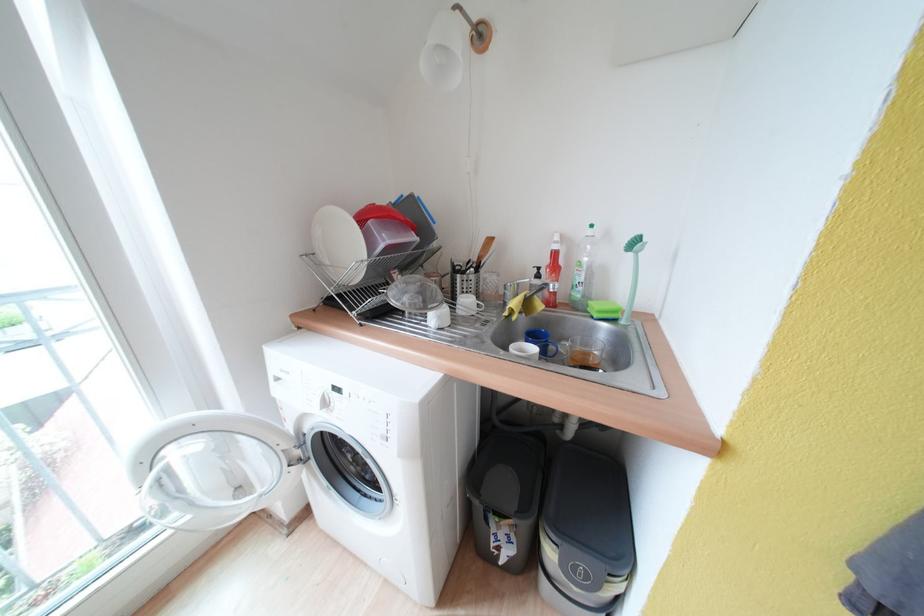
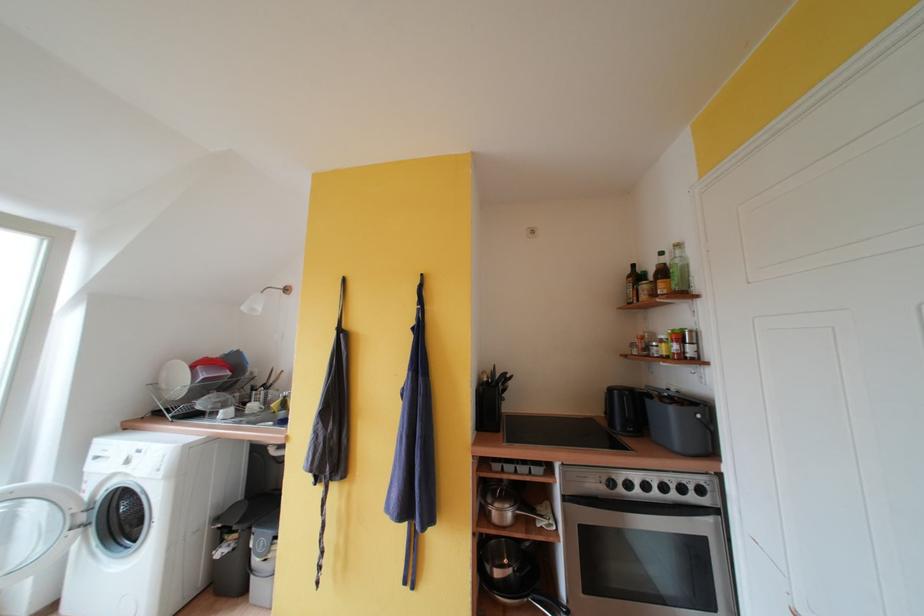
In the second image, find the point that corresponds to point 315,259 in the first image.

(160, 387)